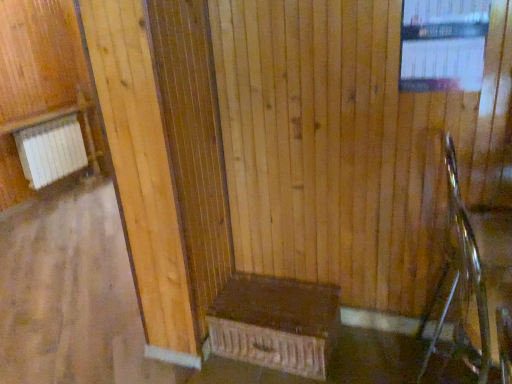
Where is `vacant space underneath metallic silver rocking chair at right (from a real-world perspective)`? The width and height of the screenshot is (512, 384). vacant space underneath metallic silver rocking chair at right (from a real-world perspective) is located at coordinates (446, 362).